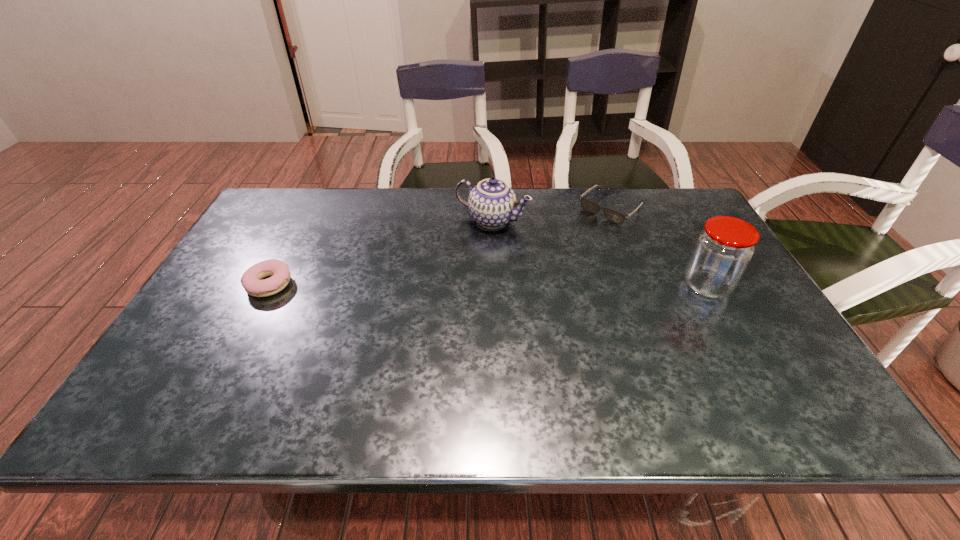
Locate an element on the screen. This screenshot has height=540, width=960. free space between the sunglasses and the leftmost object is located at coordinates (440, 247).

Find the location of `vacant region between the leftmost object and the tallest object`. vacant region between the leftmost object and the tallest object is located at coordinates (488, 286).

You are a GUI agent. You are given a task and a screenshot of the screen. Output one action in this format:
    pyautogui.click(x=<x>, y=<y>)
    Task: Click on the empty location between the leftmost object and the sunglasses
    
    Given the screenshot: What is the action you would take?
    pyautogui.click(x=440, y=247)

What are the coordinates of `vacant space that is in between the tallest object and the leftmost object` in the screenshot? It's located at (488, 286).

This screenshot has width=960, height=540. What are the coordinates of `object that is the second closest one to the rightmost object` in the screenshot? It's located at (492, 203).

This screenshot has height=540, width=960. I want to click on object that stands as the second closest to the doughnut, so [614, 216].

Where is `free location that satisfies the following two spatial constraints: 1. on the front side of the second tallest object; 2. on the left side of the jar`? The width and height of the screenshot is (960, 540). free location that satisfies the following two spatial constraints: 1. on the front side of the second tallest object; 2. on the left side of the jar is located at coordinates (494, 286).

Identify the location of free space that satisfies the following two spatial constraints: 1. on the front side of the doughnut; 2. on the left side of the tallest object. (269, 286).